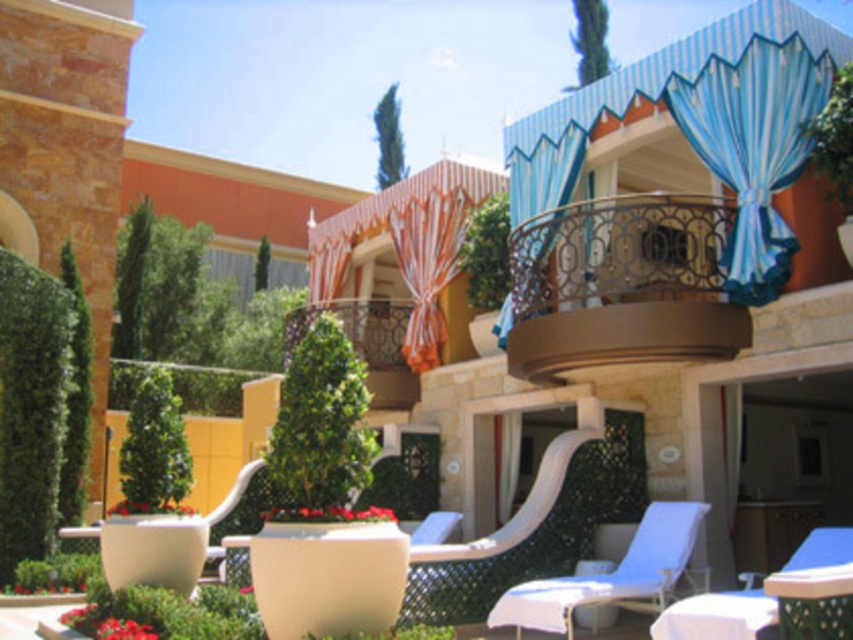
Question: In this image, where is white fabric beach chair at center located relative to blue striped curtain at upper right?

Choices:
 (A) left
 (B) right

Answer: (B)

Question: Which of the following is the farthest from the observer?

Choices:
 (A) white fabric beach chair at center
 (B) green leafy plant at center
 (C) blue striped curtain at upper right

Answer: (C)

Question: Estimate the real-world distances between objects in this image. Which object is closer to the blue striped fabric at upper right?

Choices:
 (A) white wicker beach chair at center
 (B) orange striped curtain at center
 (C) orange striped fabric at center
 (D) red matte flower at lower left

Answer: (A)

Question: Does blue fabric beach chair at lower right have a larger size compared to red matte flower at lower left?

Choices:
 (A) yes
 (B) no

Answer: (A)

Question: Which of the following is the farthest from the observer?

Choices:
 (A) white fabric beach chair at center
 (B) gold wrought iron balcony at upper center
 (C) red matte flower at lower left

Answer: (B)

Question: Does blue striped curtain at upper right appear over red matte flower at lower left?

Choices:
 (A) yes
 (B) no

Answer: (A)